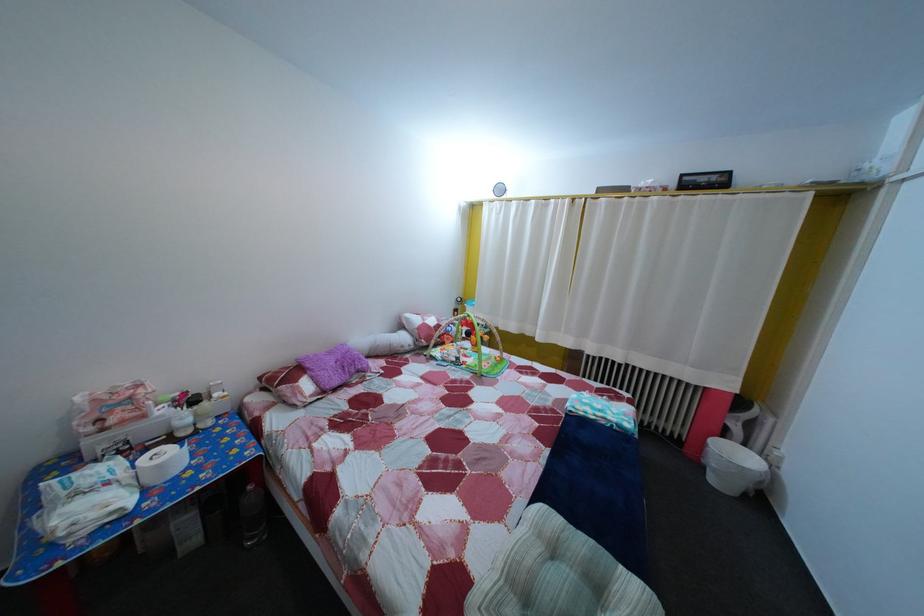
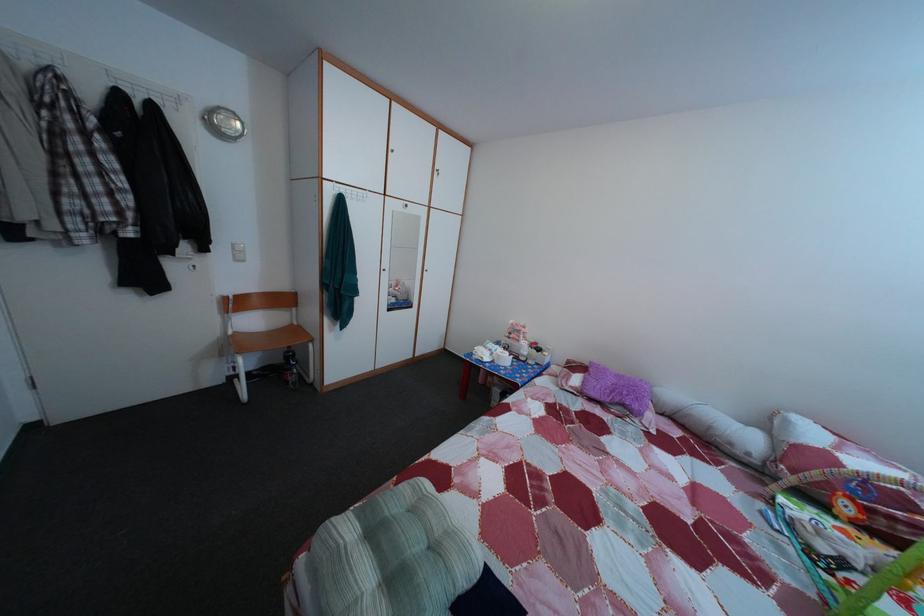
Where in the second image is the point corresponding to [153,424] from the first image?

(528, 349)